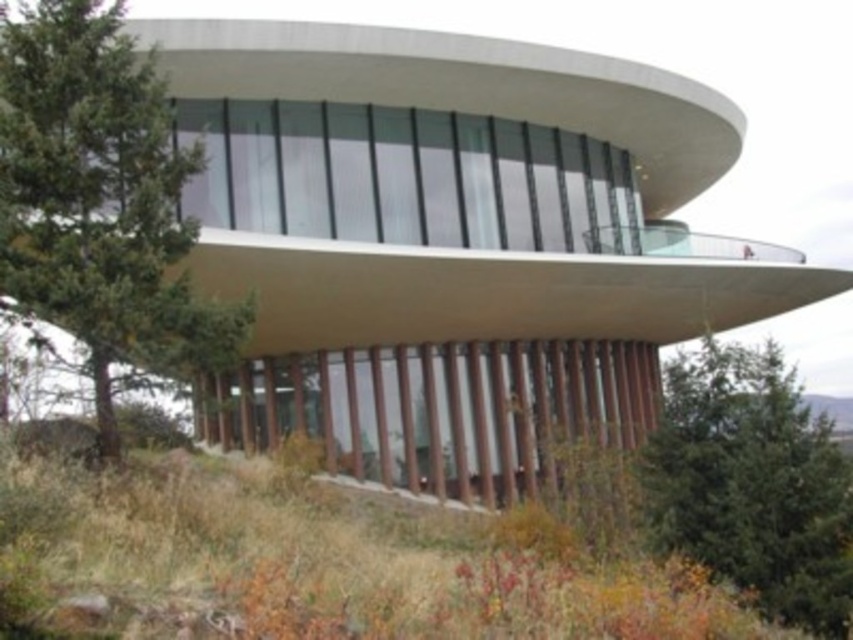
Does green coniferous tree at left appear on the right side of green leafy tree at lower right?

In fact, green coniferous tree at left is to the left of green leafy tree at lower right.

Measure the distance between green coniferous tree at left and camera.

green coniferous tree at left is 21.78 feet away from camera.

Find the location of a particular element. green coniferous tree at left is located at coordinates (100, 198).